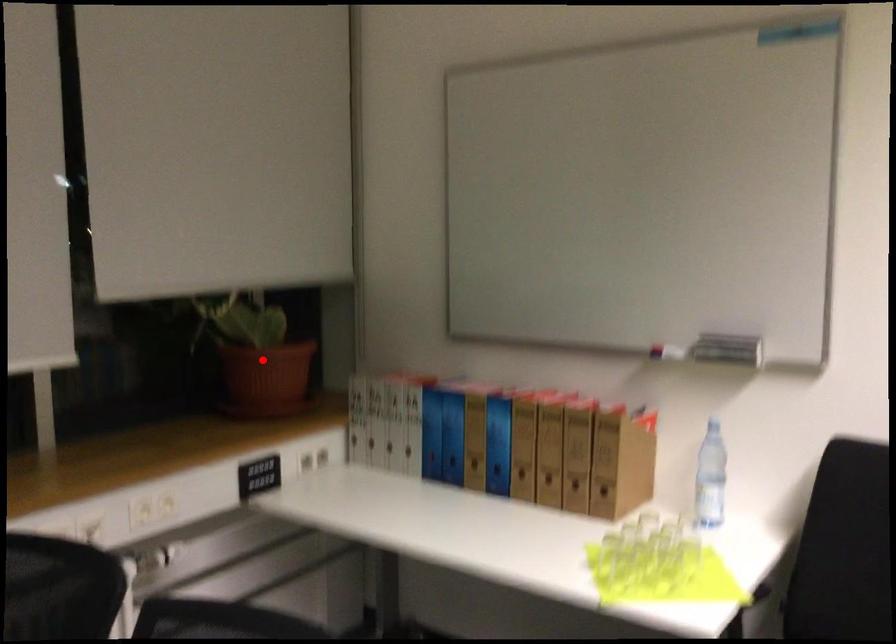
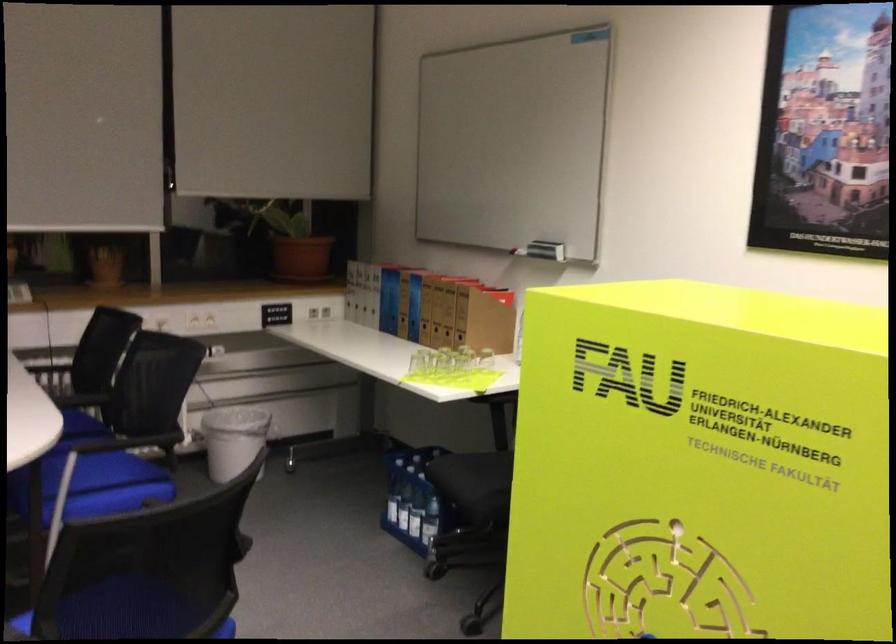
Question: I am providing you with two images of the same scene from different viewpoints. A red point is shown in image1. For the corresponding object point in image2, is it positioned nearer or farther from the camera?

Choices:
 (A) Nearer
 (B) Farther

Answer: (B)